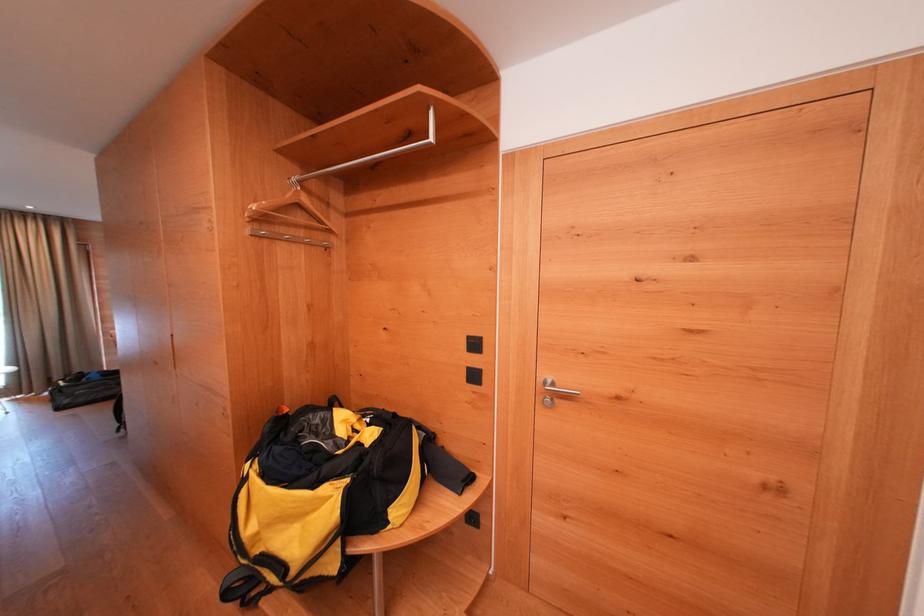
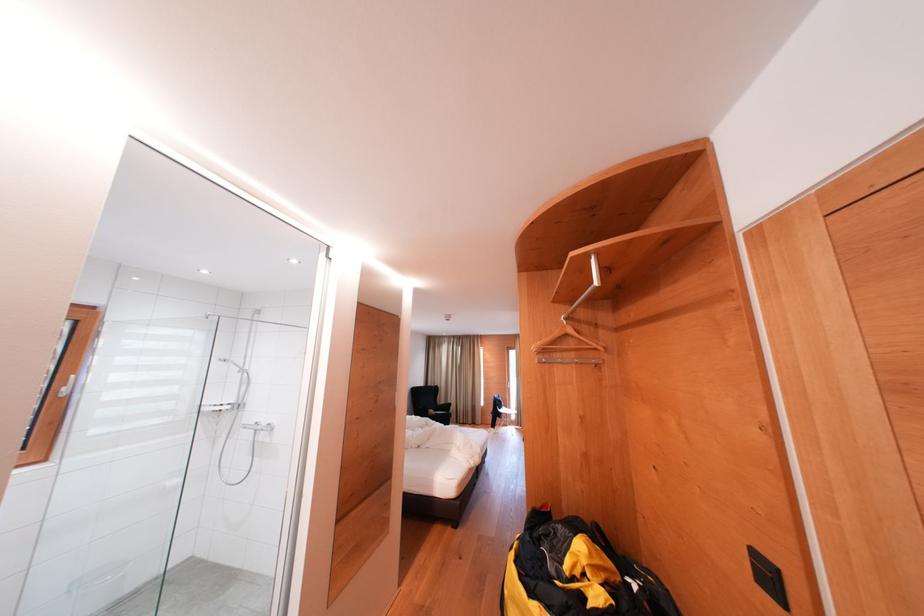
Locate, in the second image, the point that corresponds to (x=481, y=349) in the first image.

(776, 582)